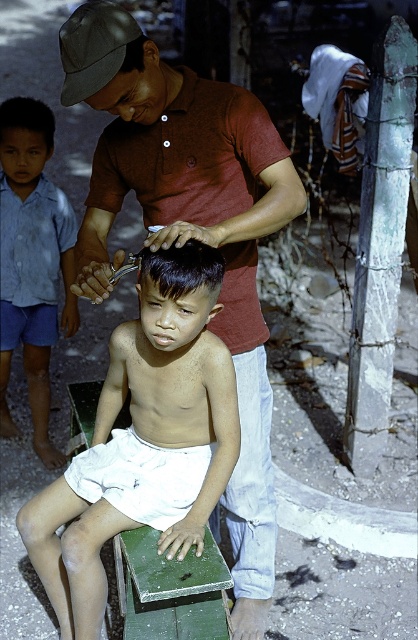
Question: Can you confirm if matte maroon shirt at center is positioned above black matte hair at center?

Choices:
 (A) yes
 (B) no

Answer: (B)

Question: Which point is closer to the camera taking this photo?

Choices:
 (A) (272, 125)
 (B) (201, 259)
 (C) (129, 456)
 (D) (48, 248)

Answer: (B)

Question: Which point is closer to the camera taking this photo?

Choices:
 (A) (203, 268)
 (B) (99, 28)
 (C) (15, 104)
 (D) (239, 161)

Answer: (B)

Question: Is smooth skin boy at center in front of blue cotton shirt at left?

Choices:
 (A) no
 (B) yes

Answer: (B)

Question: Among these points, which one is nearest to the camera?

Choices:
 (A) tap(155, 214)
 (B) tap(175, 275)

Answer: (B)

Question: Does blue cotton shirt at left appear on the left side of gray fabric baseball cap at upper left?

Choices:
 (A) yes
 (B) no

Answer: (A)